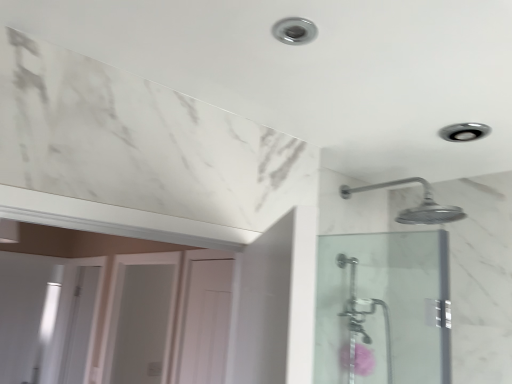
Question: Is clear glass shower door at right, which is the first screen door in right-to-left order, a part of pink fluffy flower at lower right?

Choices:
 (A) no
 (B) yes

Answer: (A)

Question: Are pink fluffy flower at lower right and clear glass shower door at right, which is the first screen door in right-to-left order, making contact?

Choices:
 (A) no
 (B) yes

Answer: (A)

Question: Is pink fluffy flower at lower right oriented away from clear glass shower door at right, which is the first screen door in right-to-left order?

Choices:
 (A) no
 (B) yes

Answer: (A)

Question: Considering the relative positions of pink fluffy flower at lower right and clear glass shower door at right, arranged as the 3th screen door when viewed from the left, in the image provided, is pink fluffy flower at lower right to the right of clear glass shower door at right, arranged as the 3th screen door when viewed from the left, from the viewer's perspective?

Choices:
 (A) yes
 (B) no

Answer: (A)

Question: Can you confirm if pink fluffy flower at lower right is wider than clear glass shower door at right, the first screen door positioned from the front?

Choices:
 (A) yes
 (B) no

Answer: (A)

Question: Is clear glass shower door at right, the first screen door positioned from the front, inside or outside of pink fluffy flower at lower right?

Choices:
 (A) outside
 (B) inside

Answer: (A)

Question: Visually, is clear glass shower door at right, the first screen door positioned from the front, positioned to the left or to the right of pink fluffy flower at lower right?

Choices:
 (A) right
 (B) left

Answer: (B)

Question: Is clear glass shower door at right, placed as the 3th screen door when sorted from back to front, taller or shorter than pink fluffy flower at lower right?

Choices:
 (A) tall
 (B) short

Answer: (A)

Question: Considering the positions of clear glass shower door at right, the first screen door positioned from the front, and pink fluffy flower at lower right in the image, is clear glass shower door at right, the first screen door positioned from the front, bigger or smaller than pink fluffy flower at lower right?

Choices:
 (A) big
 (B) small

Answer: (A)

Question: Would you say white glossy screen door at lower left, the first screen door from the back, is to the left or to the right of clear glass shower door at right, which is the first screen door in right-to-left order, in the picture?

Choices:
 (A) left
 (B) right

Answer: (A)

Question: From a real-world perspective, is white glossy screen door at lower left, which ranks as the first screen door in left-to-right order, above or below clear glass shower door at right, which is the first screen door in right-to-left order?

Choices:
 (A) below
 (B) above

Answer: (A)

Question: From the image's perspective, relative to clear glass shower door at right, which is the first screen door in right-to-left order, is white glossy screen door at lower left, the first screen door from the back, above or below?

Choices:
 (A) above
 (B) below

Answer: (B)

Question: In terms of width, does white glossy screen door at lower left, the 3th screen door viewed from the front, look wider or thinner when compared to clear glass shower door at right, placed as the 3th screen door when sorted from back to front?

Choices:
 (A) thin
 (B) wide

Answer: (A)

Question: Is white glossy door at center, the second screen door positioned from the back, bigger or smaller than white glossy screen door at lower left, which ranks as the first screen door in left-to-right order?

Choices:
 (A) big
 (B) small

Answer: (A)

Question: Is white glossy door at center, marked as the 2th screen door in a left-to-right arrangement, to the left or to the right of white glossy screen door at lower left, the first screen door from the back, in the image?

Choices:
 (A) left
 (B) right

Answer: (B)